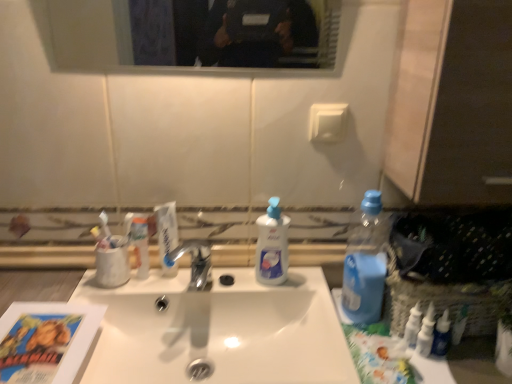
Question: Is point (442, 334) positioned closer to the camera than point (51, 26)?

Choices:
 (A) farther
 (B) closer

Answer: (B)

Question: From the image's perspective, is blue glossy bottle at lower right, the third toiletry when ordered from left to right, above or below clear glass mirror at upper center?

Choices:
 (A) above
 (B) below

Answer: (B)

Question: Based on their relative distances, which object is farther from the translucent plastic tube at center, the 1th toiletry when ordered from back to front?

Choices:
 (A) white glossy toothpaste at center
 (B) white glossy liquid soap at center
 (C) white glossy sink at center
 (D) blue plastic bottle at right
 (E) blue glossy bottle at lower right, the 1th toiletry when ordered from front to back

Answer: (E)

Question: Estimate the real-world distances between objects in this image. Which object is closer to the blue plastic bottle at right?

Choices:
 (A) white glossy liquid soap at center
 (B) white glossy toothpaste at center
 (C) white plastic bottles at right, positioned as the 2th toiletry in right-to-left order
 (D) white glossy sink at center
 (E) translucent plastic tube at center, the 1th toiletry when ordered from back to front

Answer: (C)